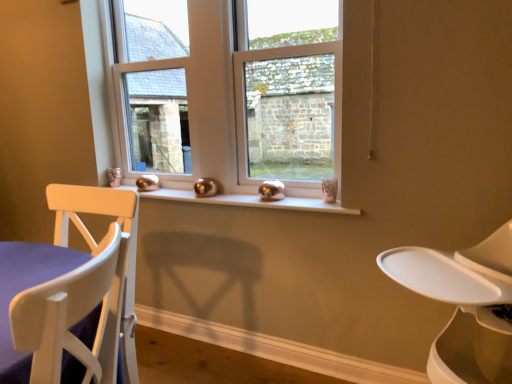
Question: From the image's perspective, is clear glass window at center located above white plastic feeding chair at right?

Choices:
 (A) yes
 (B) no

Answer: (A)

Question: Considering the relative sizes of clear glass window at center and white plastic feeding chair at right in the image provided, is clear glass window at center taller than white plastic feeding chair at right?

Choices:
 (A) no
 (B) yes

Answer: (A)

Question: Does clear glass window at center lie in front of white plastic feeding chair at right?

Choices:
 (A) no
 (B) yes

Answer: (A)

Question: From a real-world perspective, is clear glass window at center located beneath white plastic feeding chair at right?

Choices:
 (A) yes
 (B) no

Answer: (B)

Question: Would you say clear glass window at center is a long distance from white plastic feeding chair at right?

Choices:
 (A) no
 (B) yes

Answer: (B)

Question: Considering the relative positions of clear glass window at center and white plastic feeding chair at right in the image provided, is clear glass window at center to the right of white plastic feeding chair at right from the viewer's perspective?

Choices:
 (A) no
 (B) yes

Answer: (A)

Question: Considering the relative sizes of white plastic feeding chair at right and clear glass window at center in the image provided, is white plastic feeding chair at right smaller than clear glass window at center?

Choices:
 (A) yes
 (B) no

Answer: (B)

Question: Is white plastic feeding chair at right to the right of clear glass window at center from the viewer's perspective?

Choices:
 (A) no
 (B) yes

Answer: (B)

Question: Does white plastic feeding chair at right have a lesser height compared to clear glass window at center?

Choices:
 (A) yes
 (B) no

Answer: (B)

Question: Could you tell me if white plastic feeding chair at right is facing clear glass window at center?

Choices:
 (A) yes
 (B) no

Answer: (B)

Question: Does white plastic feeding chair at right lie in front of clear glass window at center?

Choices:
 (A) yes
 (B) no

Answer: (A)

Question: Would you say clear glass window at center is part of white plastic feeding chair at right's contents?

Choices:
 (A) no
 (B) yes

Answer: (A)

Question: Can you confirm if clear glass window at center is smaller than clear glass window at center?

Choices:
 (A) yes
 (B) no

Answer: (B)